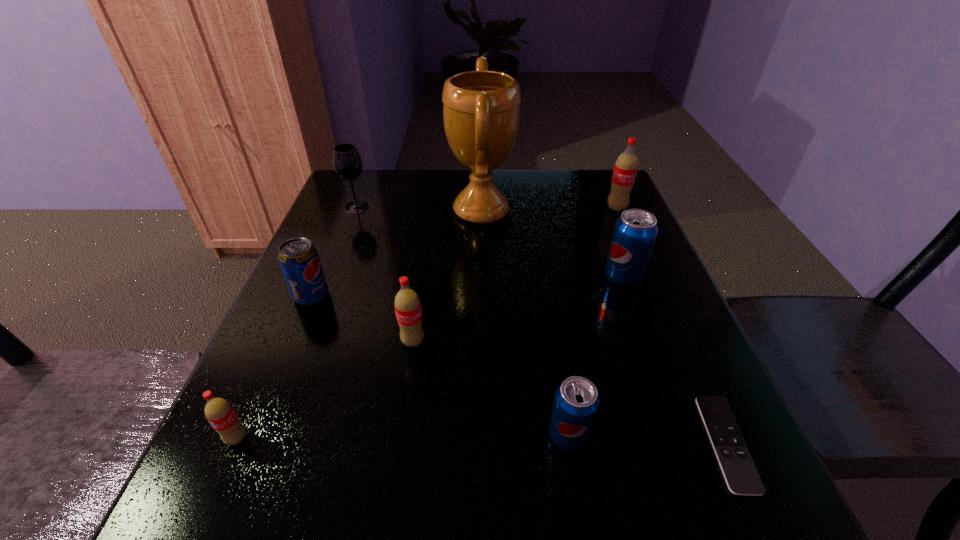
Find the location of a particular element. This screenshot has width=960, height=540. the smallest red soda is located at coordinates (219, 412).

What are the coordinates of `the left blue pop soda` in the screenshot? It's located at (576, 402).

Locate an element on the screen. the nearer blue pop soda is located at coordinates (576, 402).

At what (x,y) coordinates should I click in order to perform the action: click on black remote control. Please return your answer as a coordinate pair (x, y). The image size is (960, 540). Looking at the image, I should click on (742, 478).

Find the location of a particular element. the shortest object is located at coordinates (742, 478).

Find the location of `vacant space located 0.240m on the front of the award with the decoration`. vacant space located 0.240m on the front of the award with the decoration is located at coordinates point(357,211).

Find the location of a particular element. vacant area located 0.190m on the front of the award with the decoration is located at coordinates (376, 211).

Where is `vacant space located 0.050m on the front of the award with the decoration`? This screenshot has height=540, width=960. vacant space located 0.050m on the front of the award with the decoration is located at coordinates (429, 211).

Where is `vacant space situated 0.090m on the front of the tallest pop soda`? vacant space situated 0.090m on the front of the tallest pop soda is located at coordinates (628, 234).

You are a GUI agent. You are given a task and a screenshot of the screen. Output one action in this format:
    pyautogui.click(x=<x>, y=<y>)
    Task: Click on the vacant space located on the back of the wineglass
    The image size is (960, 540).
    Given the screenshot: What is the action you would take?
    pyautogui.click(x=366, y=184)